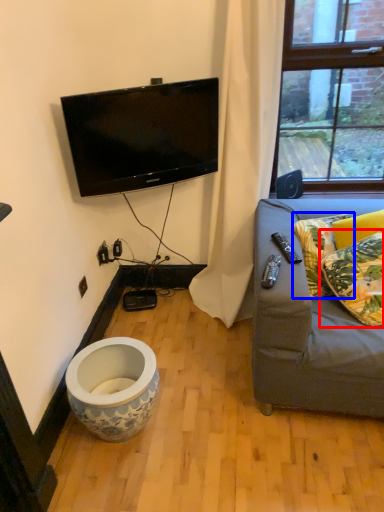
Question: Among these objects, which one is nearest to the camera, pillow (highlighted by a red box) or pillow (highlighted by a blue box)?

Choices:
 (A) pillow
 (B) pillow

Answer: (A)